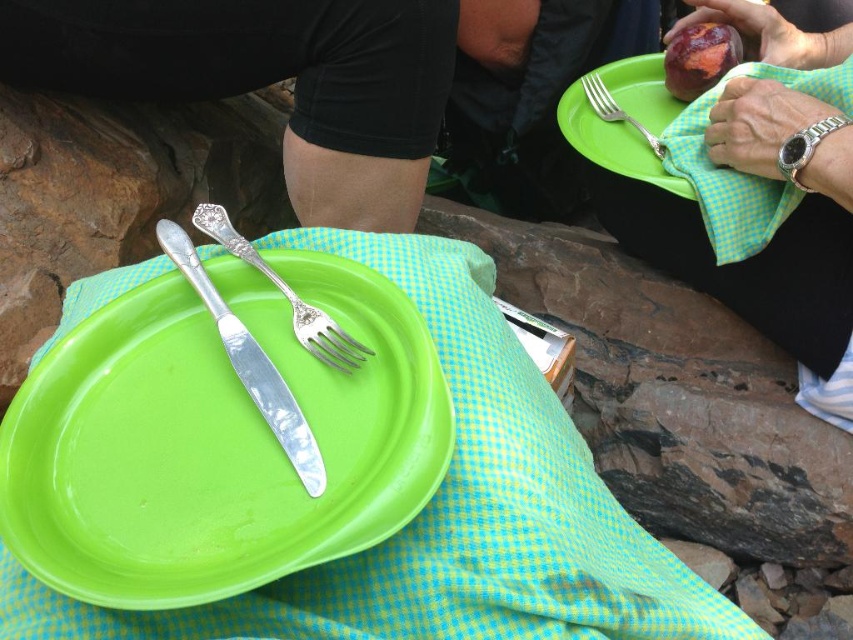
Question: Is green plastic plate at upper right to the right of silver polished fork at center from the viewer's perspective?

Choices:
 (A) yes
 (B) no

Answer: (A)

Question: Can you confirm if green plastic plate at center is positioned to the right of polished silver knife at center?

Choices:
 (A) yes
 (B) no

Answer: (A)

Question: Which of the following is the farthest from the observer?

Choices:
 (A) (351, 353)
 (B) (691, 52)
 (C) (302, 465)
 (D) (848, 204)

Answer: (B)

Question: Which of the following is the closest to the observer?

Choices:
 (A) silver metallic fork at upper right
 (B) green checkered cloth at upper right
 (C) green plastic plate at center

Answer: (C)

Question: Is green plastic plate at center below polished silver knife at center?

Choices:
 (A) no
 (B) yes

Answer: (B)

Question: Which of these objects is positioned farthest from the shiny red apple at upper right?

Choices:
 (A) polished silver knife at center
 (B) silver metallic fork at upper right
 (C) green plastic plate at upper right
 (D) green checkered cloth at upper right

Answer: (A)